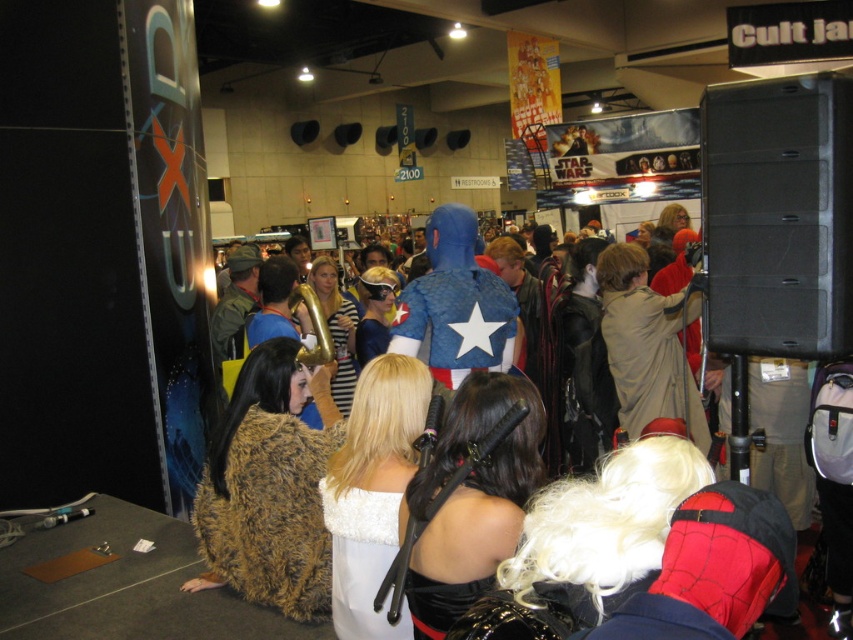
You are at the event and want to take a photo of the fuzzy brown coat at lower left and the white fuzzy coat at center. Which coat should you frame first in your camera viewfinder to ensure both are in the shot?

The fuzzy brown coat at lower left should be framed first since it is positioned on the left side of the white fuzzy coat at center, allowing both to be captured in the same frame when aligned properly.

You are standing at the center of the convention hall and want to locate the fuzzy brown coat at lower left. According to the coordinates provided, in which direction should you move to find it?

The fuzzy brown coat at lower left is located at coordinates point (270, 513), so you should move to the lower left direction to find it.